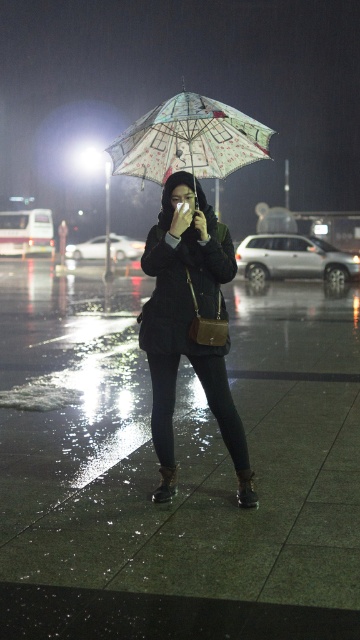
You are a delivery person who needs to place a small package between the dark matte jacket at center and the patterned fabric umbrella at center. The package is 12 inches long. Can you fit it between them?

The distance between the dark matte jacket at center and the patterned fabric umbrella at center is 34.09 inches. Since the package is only 12 inches long, there is enough space to fit it between them.

You are a delivery person who needs to place a small package on the glossy concrete pavement at center without it getting wet from the rain. Considering the patterned fabric umbrella at center, can you use the umbrella to protect the package while placing it?

The glossy concrete pavement at center is larger in size than the patterned fabric umbrella at center. Since the umbrella is smaller, it might not fully cover the entire pavement area. However, you can position the umbrella directly over the spot where the package will be placed to keep it dry while you place it there.